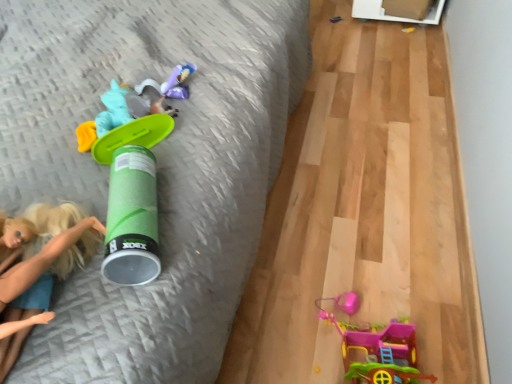
This screenshot has height=384, width=512. Find the location of `free space to the back side of metallic silver toy at upper right, acting as the 5th toy starting from the left`. free space to the back side of metallic silver toy at upper right, acting as the 5th toy starting from the left is located at coordinates (333, 9).